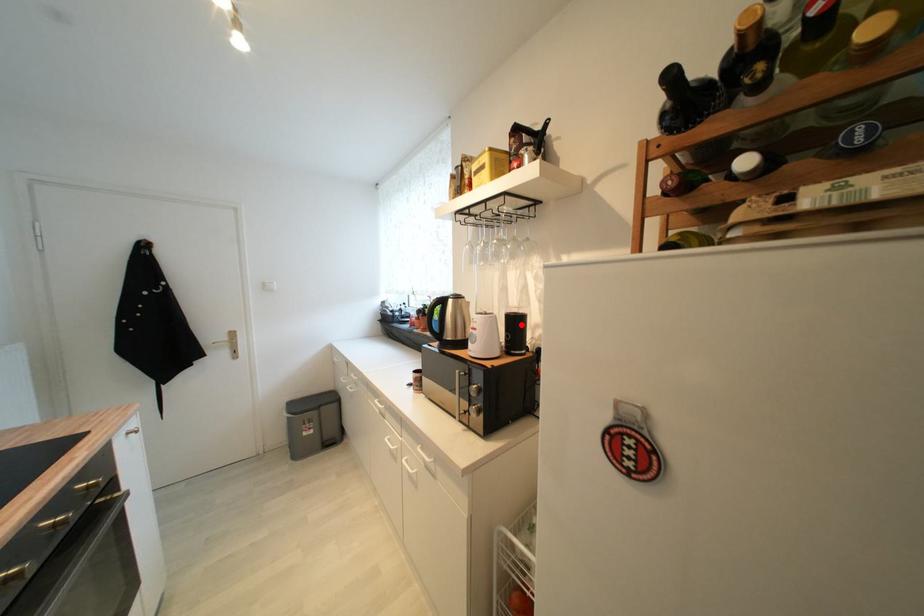
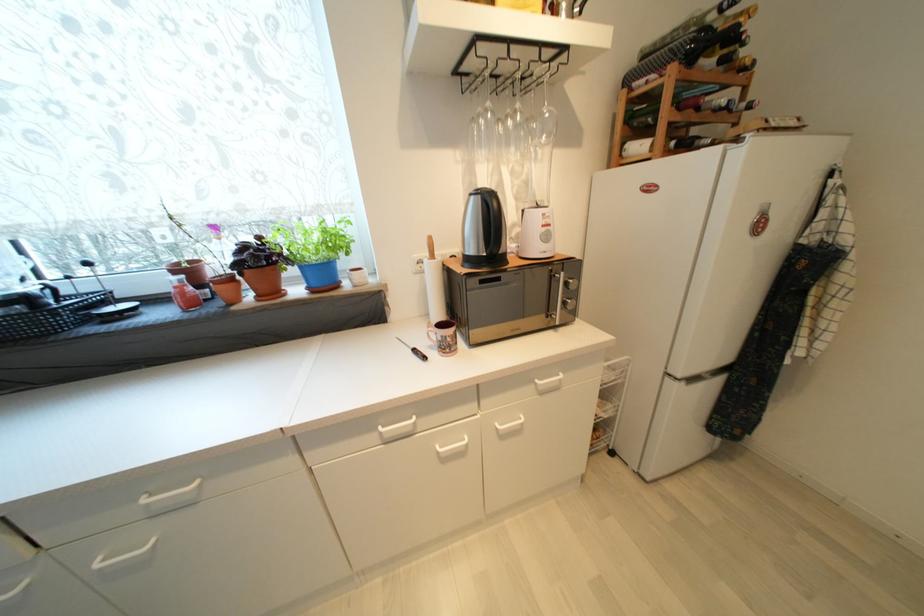
Question: I am providing you with two images of the same scene from different viewpoints. A red point is marked on the first image. Is the red point's position out of view in image 2?

Choices:
 (A) Yes
 (B) No

Answer: (A)